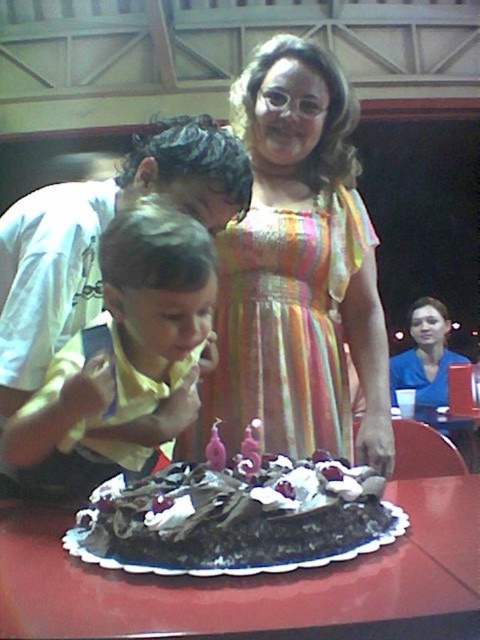
Which is below, multicolored striped dress at center or chocolate frosted cake at center?

Positioned lower is chocolate frosted cake at center.

Is point (284, 205) closer to camera compared to point (154, 524)?

No, (284, 205) is further to viewer.

You are a GUI agent. You are given a task and a screenshot of the screen. Output one action in this format:
    pyautogui.click(x=<x>, y=<y>)
    Task: Click on the multicolored striped dress at center
    The image size is (480, 640).
    Given the screenshot: What is the action you would take?
    pyautogui.click(x=298, y=269)

Looking at this image, which is more to the right, matte yellow shirt at left or blue fabric shirt at center?

Positioned to the right is blue fabric shirt at center.

Image resolution: width=480 pixels, height=640 pixels. What do you see at coordinates (122, 358) in the screenshot?
I see `matte yellow shirt at left` at bounding box center [122, 358].

What are the coordinates of `matte yellow shirt at left` in the screenshot? It's located at (122, 358).

Who is more distant from viewer, (216, 532) or (208, 458)?

Positioned behind is point (208, 458).

What do you see at coordinates (236, 518) in the screenshot?
I see `chocolate frosted cake at center` at bounding box center [236, 518].

This screenshot has height=640, width=480. What do you see at coordinates (236, 518) in the screenshot?
I see `chocolate frosted cake at center` at bounding box center [236, 518].

Locate an element on the screen. chocolate frosted cake at center is located at coordinates (236, 518).